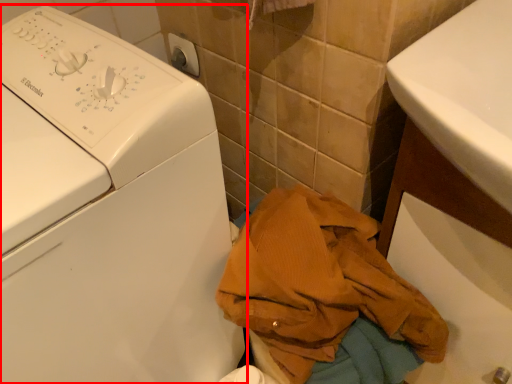
Question: From the image's perspective, where is washing machine (annotated by the red box) located relative to clothing?

Choices:
 (A) below
 (B) above

Answer: (B)